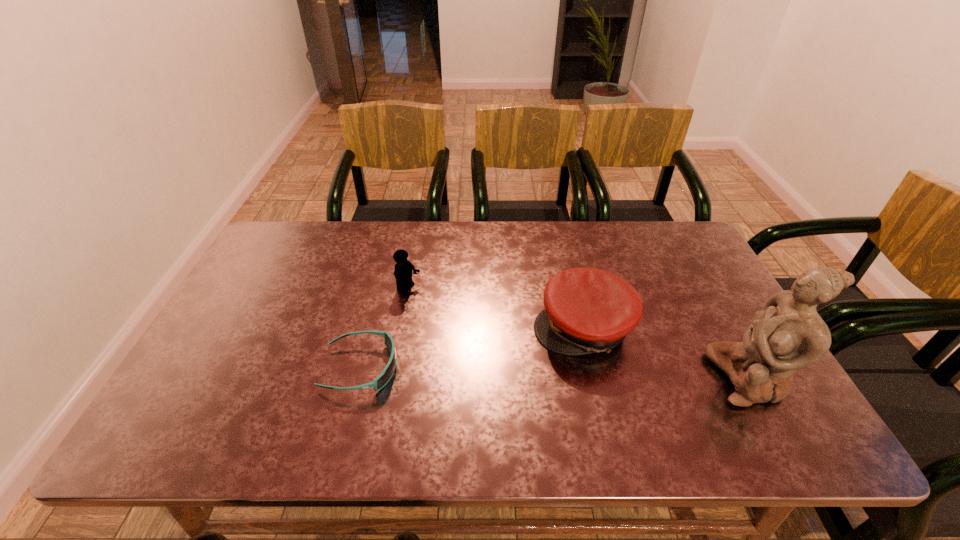
Locate an element on the screen. Image resolution: width=960 pixels, height=540 pixels. the shortest object is located at coordinates (385, 376).

You are a GUI agent. You are given a task and a screenshot of the screen. Output one action in this format:
    pyautogui.click(x=<x>, y=<y>)
    Task: Click on the rightmost object
    
    Given the screenshot: What is the action you would take?
    coord(789,334)

Where is `the tallest object`? The image size is (960, 540). the tallest object is located at coordinates (789, 334).

The height and width of the screenshot is (540, 960). In order to click on Lego in this screenshot , I will do `click(403, 269)`.

Where is `the second object from right to left`? the second object from right to left is located at coordinates (587, 310).

Image resolution: width=960 pixels, height=540 pixels. Find the location of `vacant space located on the front-facing side of the sunglasses`. vacant space located on the front-facing side of the sunglasses is located at coordinates (513, 368).

Identify the location of vacant space situated 0.120m on the front-facing side of the tallest object. (663, 377).

Find the location of a particular element. The height and width of the screenshot is (540, 960). free point located on the front-facing side of the tallest object is located at coordinates (626, 377).

At what (x,y) coordinates should I click in order to perform the action: click on vacant space situated 0.080m on the front-facing side of the tallest object. Please return your answer as a coordinate pair (x, y). Looking at the image, I should click on (680, 377).

The image size is (960, 540). Identify the location of free space located 0.150m on the front-facing side of the Lego. (458, 316).